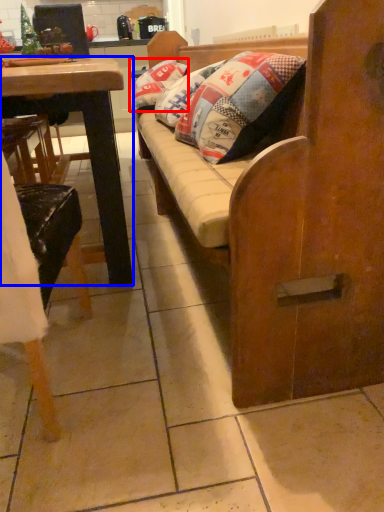
Question: Which object appears closest to the camera in this image, pillow (highlighted by a red box) or desk (highlighted by a blue box)?

Choices:
 (A) pillow
 (B) desk

Answer: (B)